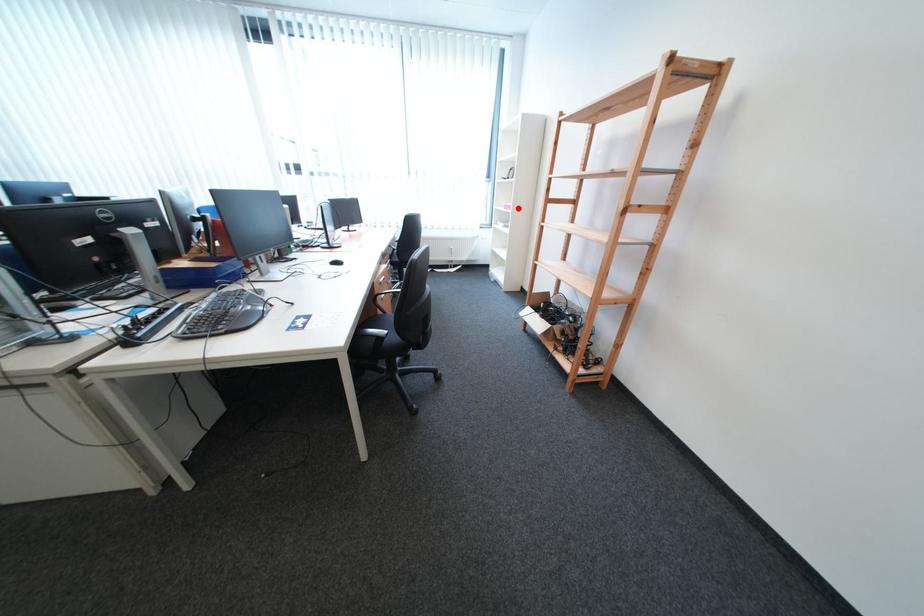
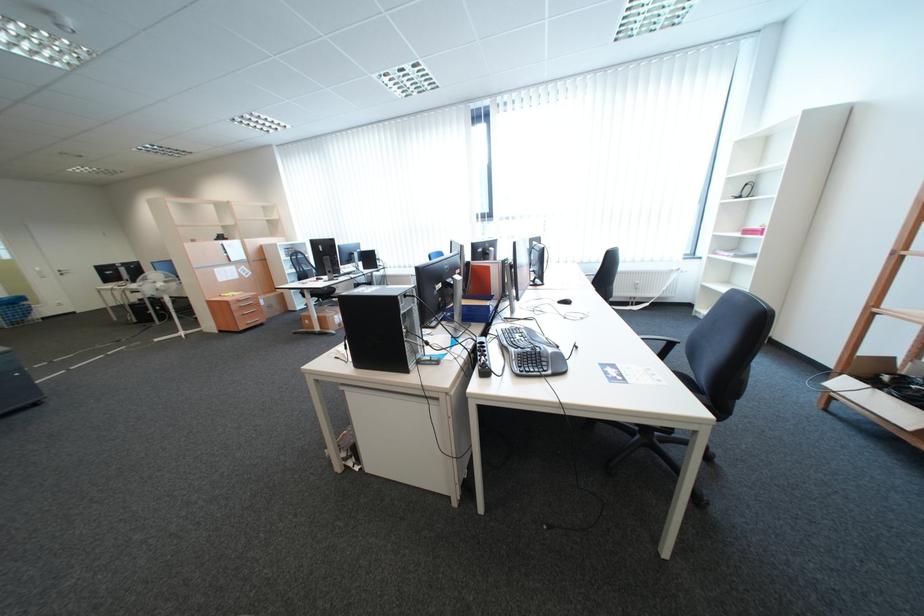
The point at the highlighted location is marked in the first image. Where is the corresponding point in the second image?

(758, 233)